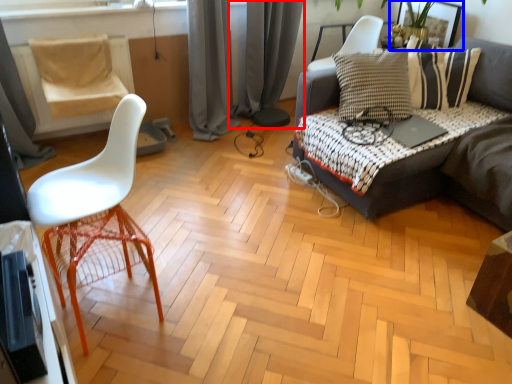
Question: Which point is closer to the camera, curtain (highlighted by a red box) or picture frame (highlighted by a blue box)?

Choices:
 (A) curtain
 (B) picture frame

Answer: (A)